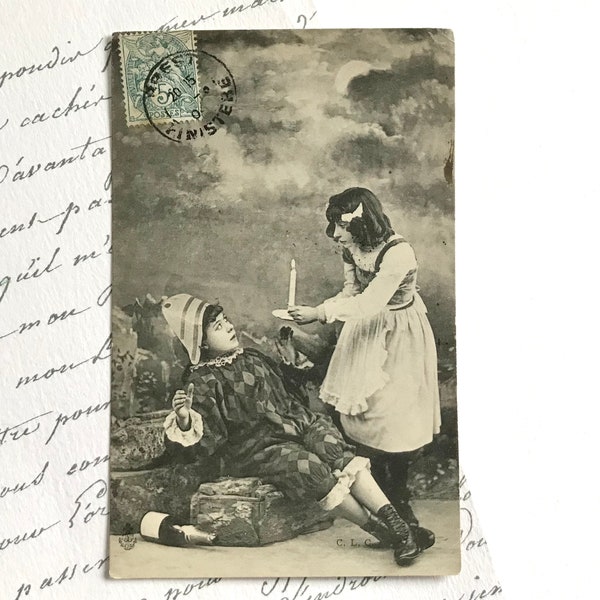
Find the location of a particular element. wall is located at coordinates (300, 223).